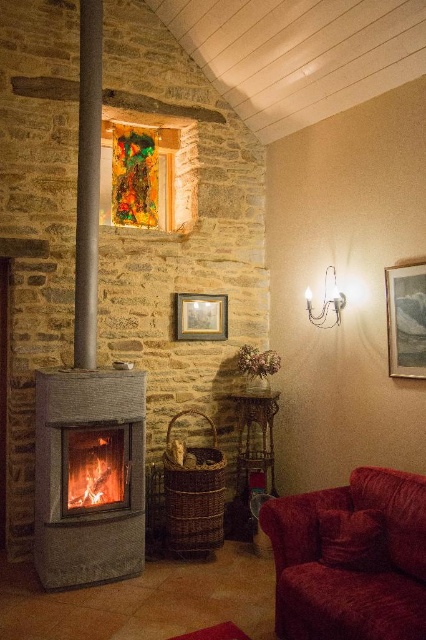
Question: Does matte gray fireplace at left appear on the right side of smooth gray beam at left?

Choices:
 (A) no
 (B) yes

Answer: (B)

Question: Which object appears closest to the camera in this image?

Choices:
 (A) velvet red couch at lower right
 (B) orange glowing wood at center
 (C) smooth gray beam at left

Answer: (A)

Question: Can you confirm if velvet red couch at lower right is thinner than smooth gray beam at left?

Choices:
 (A) no
 (B) yes

Answer: (A)

Question: Which of the following is the farthest from the observer?

Choices:
 (A) (72, 499)
 (B) (66, 445)
 (C) (75, 225)

Answer: (C)

Question: Can you confirm if smooth gray beam at left is positioned below orange glowing wood at center?

Choices:
 (A) no
 (B) yes

Answer: (A)

Question: Which point is closer to the camera taking this photo?

Choices:
 (A) (77, 362)
 (B) (118, 490)

Answer: (B)